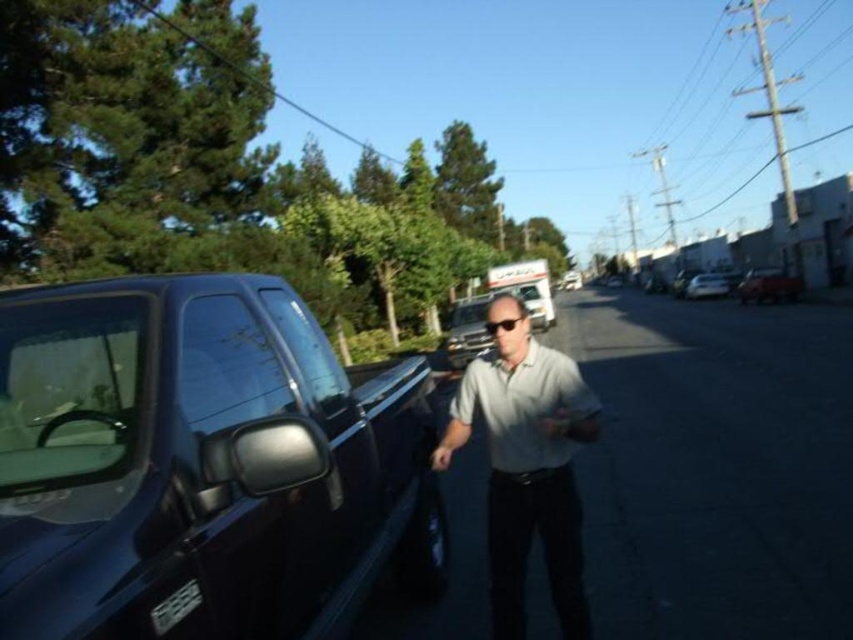
Is glossy black truck at left smaller than white glossy car at center?

Correct, glossy black truck at left occupies less space than white glossy car at center.

Is glossy black truck at left positioned before white glossy car at center?

Yes.

Which is behind, point (227, 278) or point (689, 284)?

Point (689, 284)

Where is `glossy black truck at left`? The width and height of the screenshot is (853, 640). glossy black truck at left is located at coordinates (202, 465).

Image resolution: width=853 pixels, height=640 pixels. Describe the element at coordinates (202, 465) in the screenshot. I see `glossy black truck at left` at that location.

Can you confirm if glossy black truck at left is taller than metallic silver truck at center?

Incorrect, glossy black truck at left's height is not larger of metallic silver truck at center's.

Between point (180, 538) and point (450, 330), which one is positioned in front?

Point (180, 538) is more forward.

The height and width of the screenshot is (640, 853). Find the location of `glossy black truck at left`. glossy black truck at left is located at coordinates (202, 465).

Does gray cotton shirt at center have a larger size compared to metallic silver truck at center?

Actually, gray cotton shirt at center might be smaller than metallic silver truck at center.

Is point (515, 449) farther from camera compared to point (468, 312)?

No, (515, 449) is in front of (468, 312).

The image size is (853, 640). What are the coordinates of `gray cotton shirt at center` in the screenshot? It's located at (526, 465).